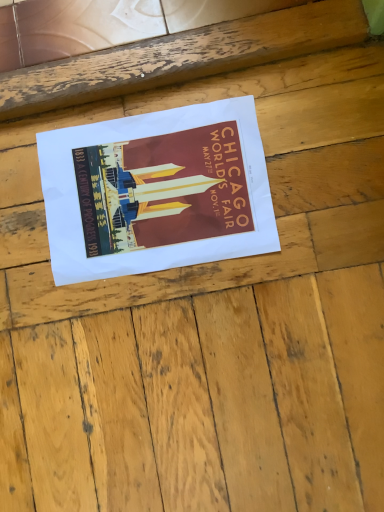
Image resolution: width=384 pixels, height=512 pixels. What are the coordinates of `vacant space in front of matte paper poster at center` in the screenshot? It's located at (210, 356).